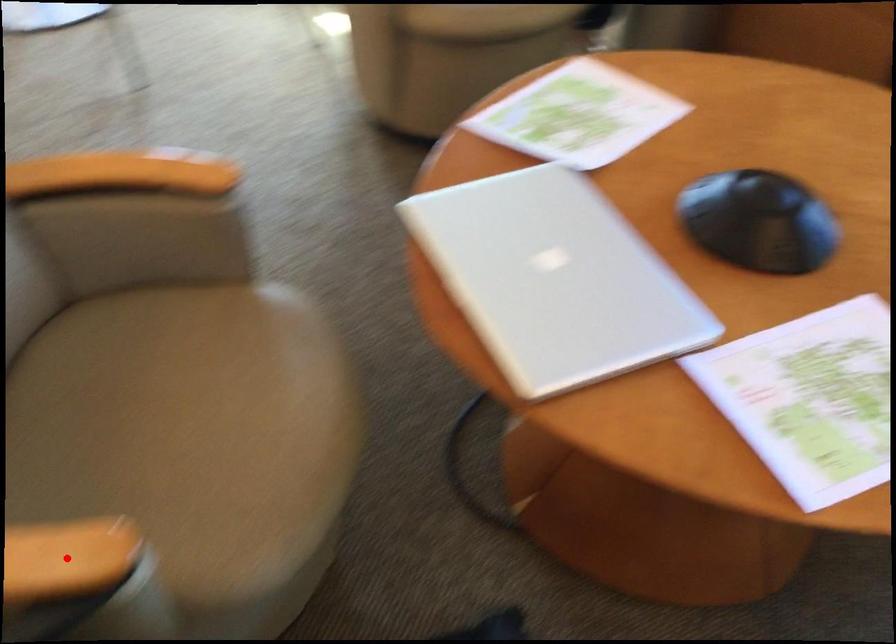
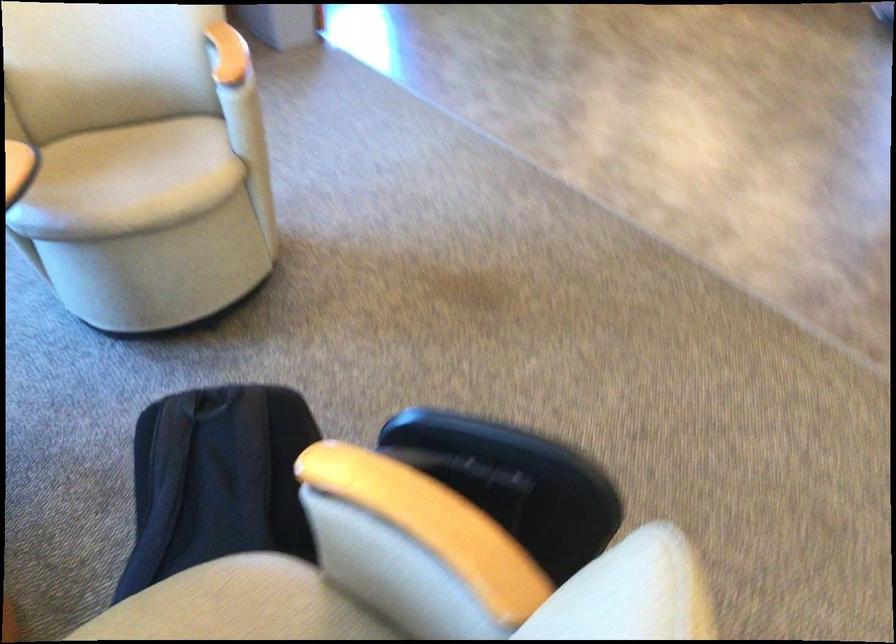
Question: I am providing you with two images of the same scene from different viewpoints. A red point is marked on the first image. At the location where the point appears in image 1, is it still visible in image 2?

Choices:
 (A) Yes
 (B) No

Answer: (B)